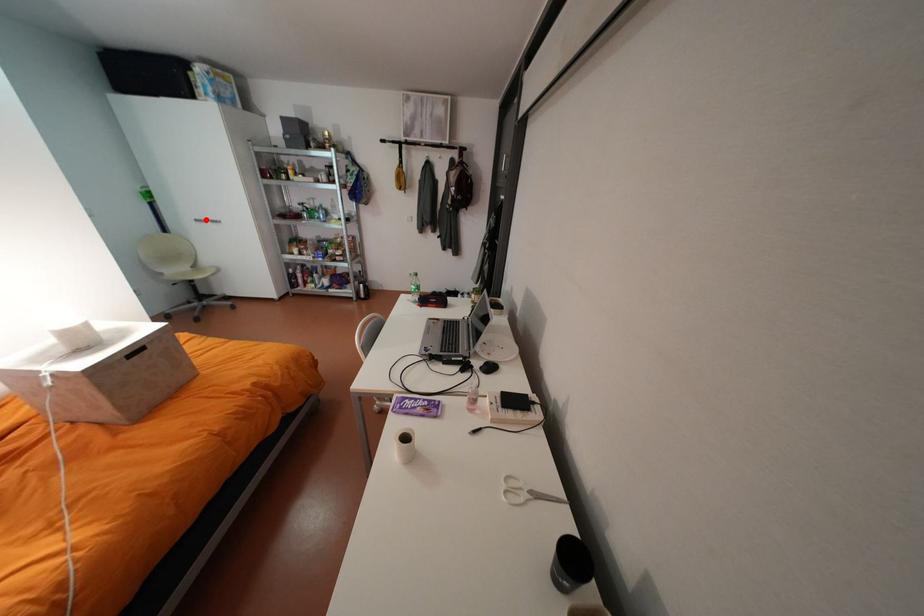
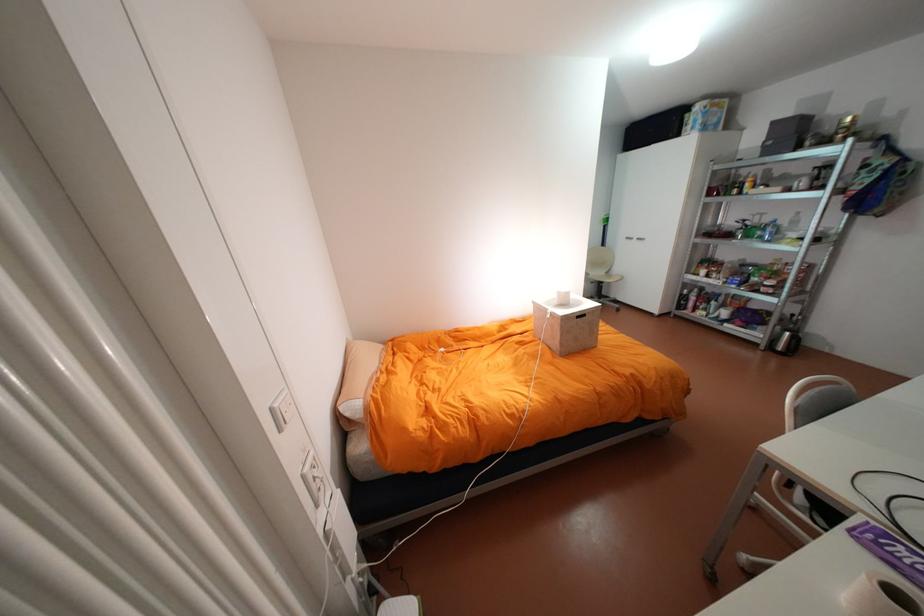
The point at the highlighted location is marked in the first image. Where is the corresponding point in the second image?

(636, 237)